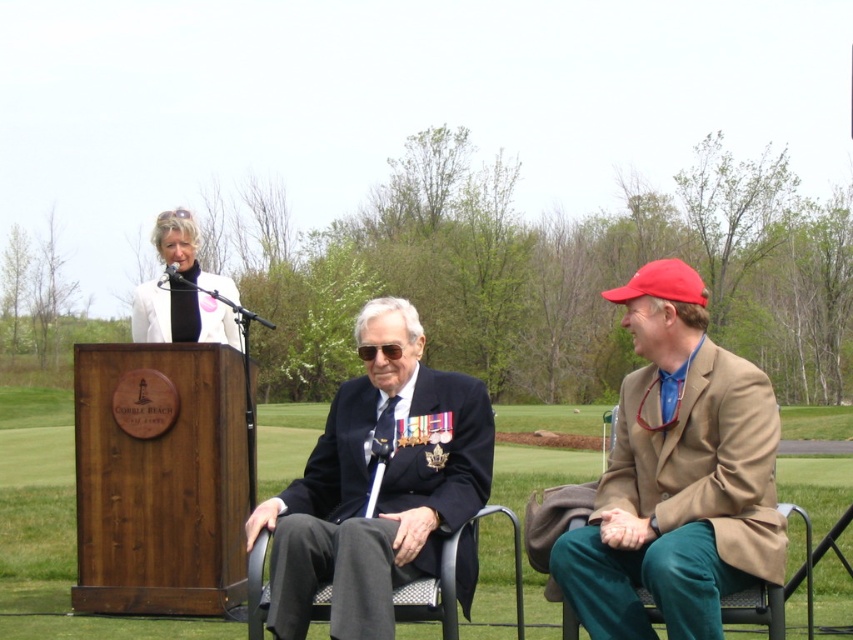
You are standing at the center of the image. Which direction should you look to see the tan fabric blazer at right?

You should look to the right to see the tan fabric blazer at right since it is located at the right side of the image.

What is located at the coordinates point (35, 499) in the image?

The point (35, 499) indicates green grass at center.